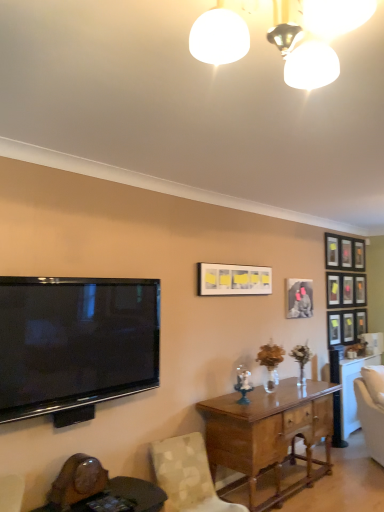
Question: Is the surface of light brown wood desk at center in direct contact with matte black picture frame at upper right, which appears as the 2th picture frame when viewed from the front?

Choices:
 (A) yes
 (B) no

Answer: (B)

Question: Considering the relative positions of light brown wood desk at center and matte black picture frame at upper right, the fifth picture frame from the right, in the image provided, is light brown wood desk at center to the right of matte black picture frame at upper right, the fifth picture frame from the right, from the viewer's perspective?

Choices:
 (A) no
 (B) yes

Answer: (A)

Question: Can you confirm if light brown wood desk at center is smaller than matte black picture frame at upper right, the fifth picture frame from the right?

Choices:
 (A) no
 (B) yes

Answer: (A)

Question: Is light brown wood desk at center at the left side of matte black picture frame at upper right, the 5th picture frame in the back-to-front sequence?

Choices:
 (A) yes
 (B) no

Answer: (A)

Question: From a real-world perspective, is light brown wood desk at center located beneath matte black picture frame at upper right, which appears as the 2th picture frame when viewed from the front?

Choices:
 (A) yes
 (B) no

Answer: (A)

Question: Is matte black picture frame at upper right, the 2th picture frame viewed from the left, bigger or smaller than wooden picture frame at center-right, which is the 4th picture frame from back to front?

Choices:
 (A) small
 (B) big

Answer: (B)

Question: Looking at their shapes, would you say matte black picture frame at upper right, which appears as the 2th picture frame when viewed from the front, is wider or thinner than wooden picture frame at center-right, which is the 4th picture frame from back to front?

Choices:
 (A) thin
 (B) wide

Answer: (B)

Question: From the image's perspective, is matte black picture frame at upper right, the 2th picture frame viewed from the left, located above or below wooden picture frame at center-right, the 4th picture frame positioned from the right?

Choices:
 (A) below
 (B) above

Answer: (B)

Question: Is matte black picture frame at upper right, which appears as the 2th picture frame when viewed from the front, taller or shorter than wooden picture frame at center-right, which is the 4th picture frame from back to front?

Choices:
 (A) short
 (B) tall

Answer: (A)

Question: In the image, is wooden picture frame at center-right, which is the 4th picture frame from back to front, positioned in front of or behind wooden round table at lower left?

Choices:
 (A) front
 (B) behind

Answer: (B)

Question: Considering the positions of wooden picture frame at center-right, which is the third picture frame in front-to-back order, and wooden round table at lower left in the image, is wooden picture frame at center-right, which is the third picture frame in front-to-back order, wider or thinner than wooden round table at lower left?

Choices:
 (A) thin
 (B) wide

Answer: (A)

Question: From a real-world perspective, is wooden picture frame at center-right, which is the third picture frame in front-to-back order, above or below wooden round table at lower left?

Choices:
 (A) above
 (B) below

Answer: (A)

Question: In terms of size, does wooden picture frame at center-right, the 4th picture frame positioned from the right, appear bigger or smaller than wooden round table at lower left?

Choices:
 (A) big
 (B) small

Answer: (B)

Question: Considering the positions of wooden round table at lower left and white glossy light fixture at upper center in the image, is wooden round table at lower left taller or shorter than white glossy light fixture at upper center?

Choices:
 (A) tall
 (B) short

Answer: (A)

Question: Considering the positions of wooden round table at lower left and white glossy light fixture at upper center in the image, is wooden round table at lower left wider or thinner than white glossy light fixture at upper center?

Choices:
 (A) wide
 (B) thin

Answer: (A)